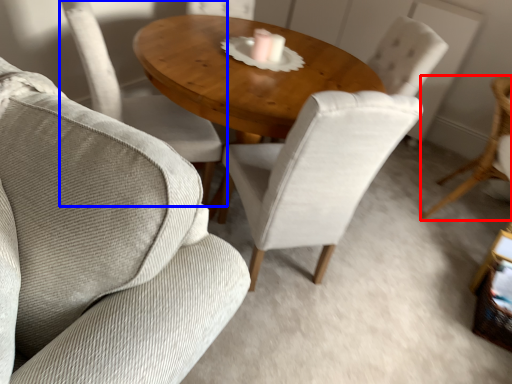
Question: Among these objects, which one is farthest to the camera, chair (highlighted by a red box) or chair (highlighted by a blue box)?

Choices:
 (A) chair
 (B) chair

Answer: (A)